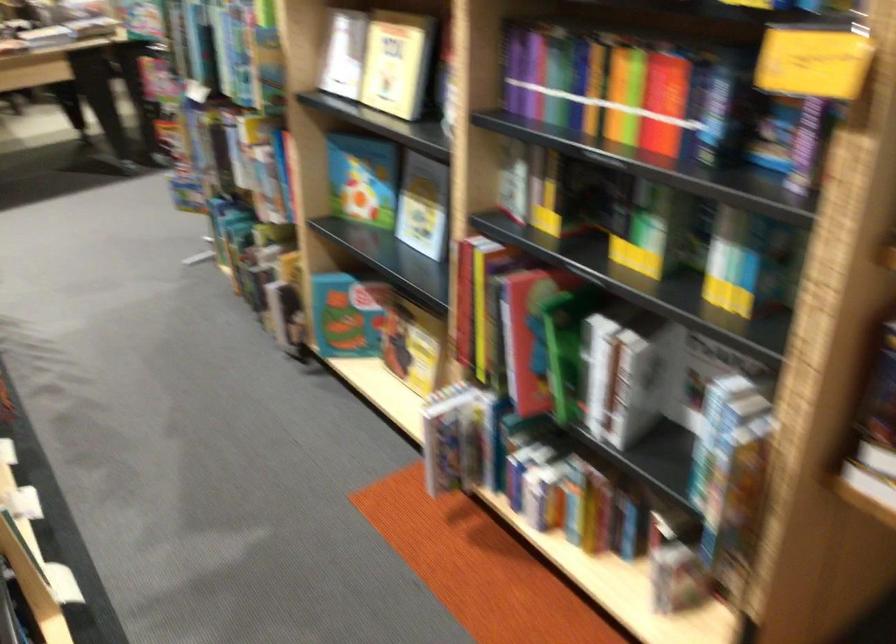
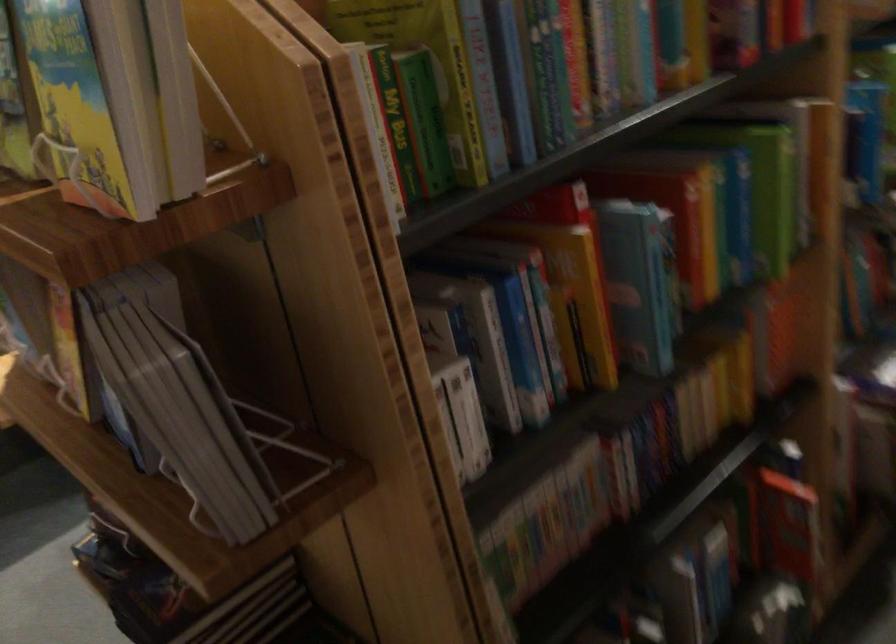
Question: I am providing you with two images of the same scene from different viewpoints. Which of the following objects are not visible in image2?

Choices:
 (A) stacked grey books
 (B) blender pitcher handle
 (C) green spine book
 (D) white cup handle

Answer: (C)